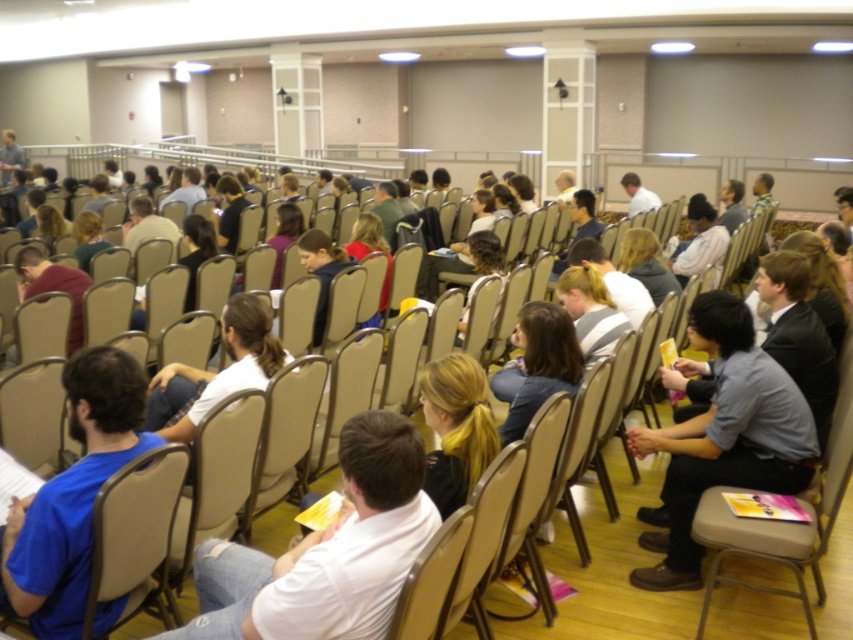
Can you confirm if light gray fabric shirt at center right is positioned to the left of beige plastic chair at lower left?

No, light gray fabric shirt at center right is not to the left of beige plastic chair at lower left.

Which is above, light gray fabric shirt at center right or beige plastic chair at lower left?

light gray fabric shirt at center right

Between point (729, 452) and point (76, 632), which one is positioned in front?

Point (76, 632)

In order to click on light gray fabric shirt at center right in this screenshot , I will do `click(724, 436)`.

Which of these two, white matte shirt at center or light gray fabric shirt at center right, stands shorter?

Standing shorter between the two is white matte shirt at center.

Which is above, white matte shirt at center or light gray fabric shirt at center right?

light gray fabric shirt at center right is above.

Which is in front, point (366, 570) or point (722, 292)?

Point (366, 570) is more forward.

Locate an element on the screen. Image resolution: width=853 pixels, height=640 pixels. white matte shirt at center is located at coordinates (326, 552).

Who is positioned more to the left, light gray fabric shirt at center right or beige fabric chair at center?

Positioned to the left is beige fabric chair at center.

Who is shorter, light gray fabric shirt at center right or beige fabric chair at center?

With less height is beige fabric chair at center.

Who is more forward, (753, 381) or (193, 544)?

Point (193, 544) is more forward.

Locate an element on the screen. light gray fabric shirt at center right is located at coordinates (724, 436).